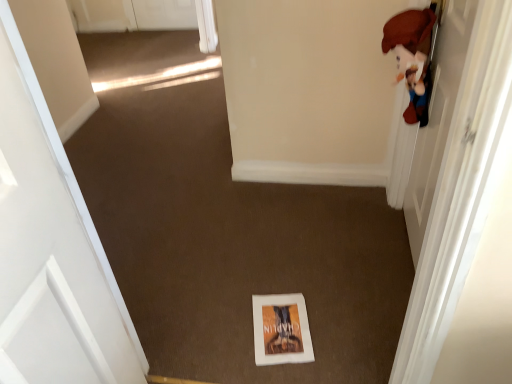
Locate an element on the screen. This screenshot has width=512, height=384. free space in front of white paper book at center is located at coordinates (294, 371).